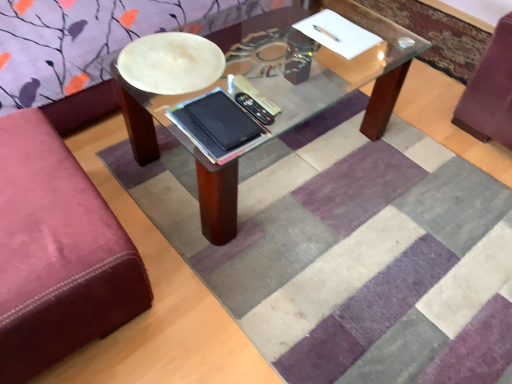
In order to click on vacant area situated below black matte tablet at center (from a real-world perspective) in this screenshot , I will do `click(219, 115)`.